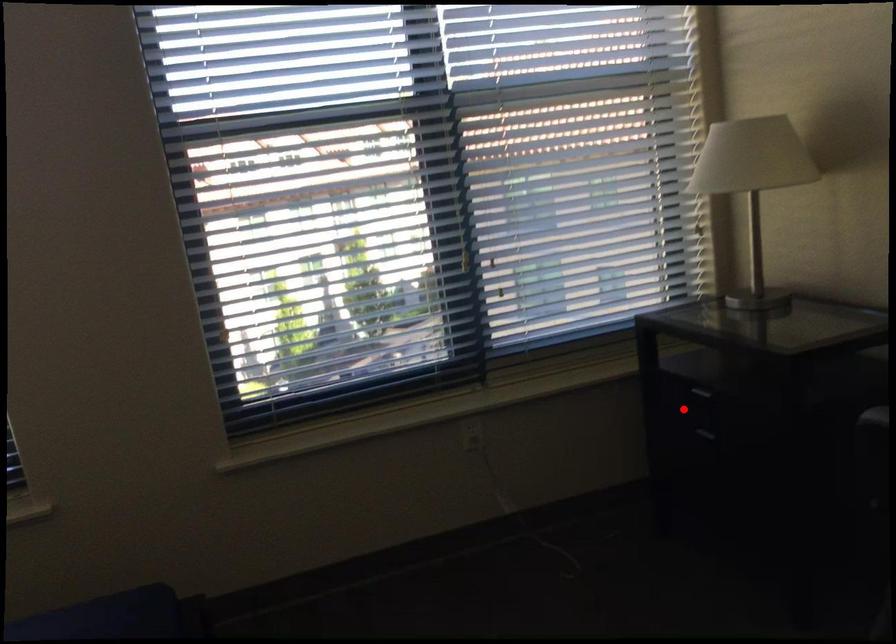
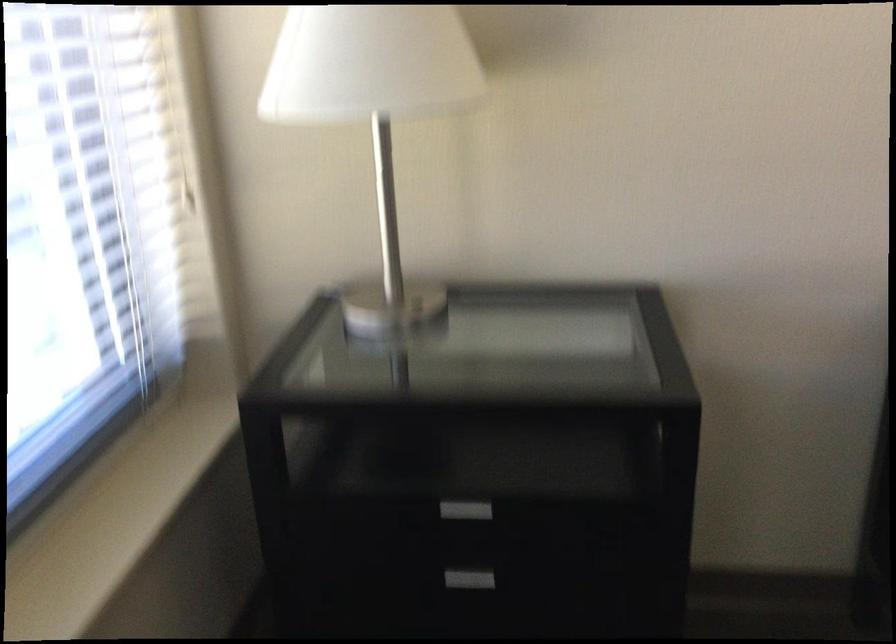
Where in the second image is the point corresponding to the highlighted location from the first image?

(461, 511)